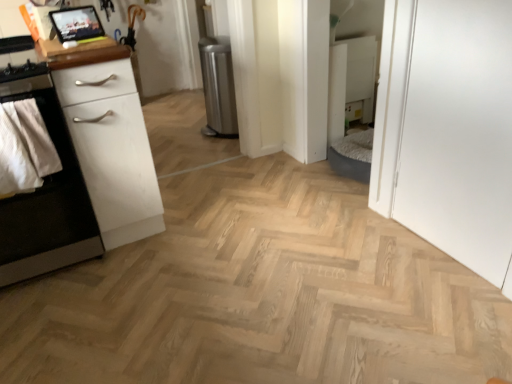
The height and width of the screenshot is (384, 512). What are the coordinates of `free space in front of white matte cabinet at left` in the screenshot? It's located at (58, 317).